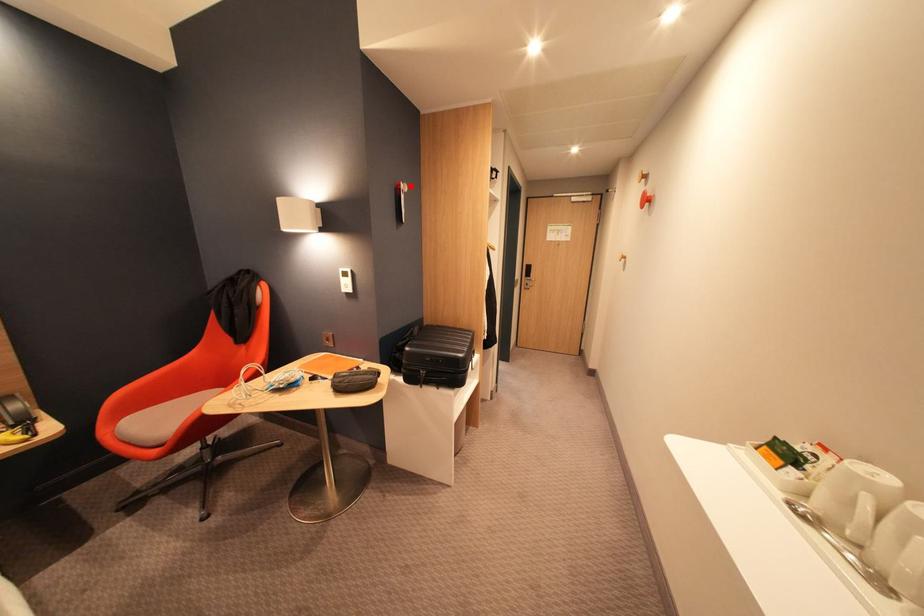
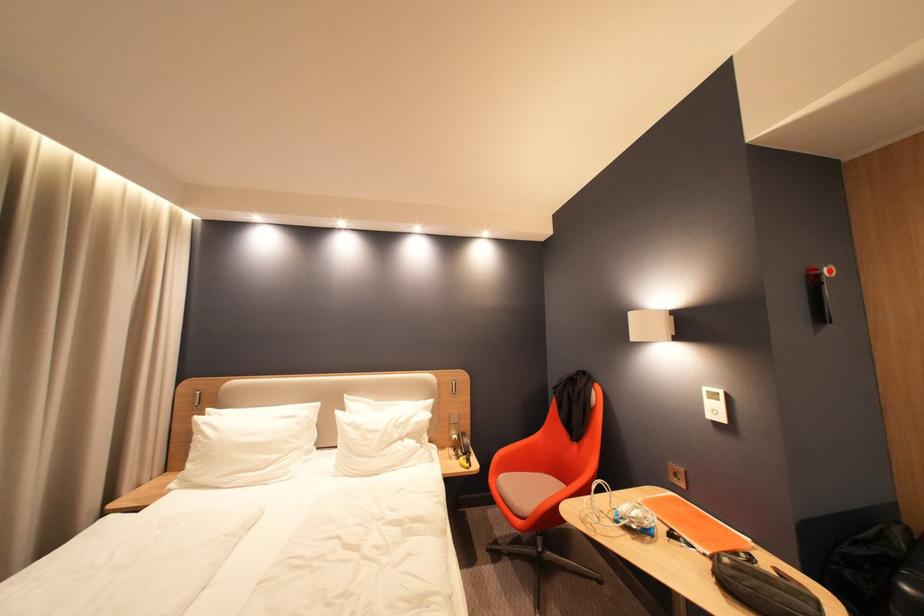
From the picture: I am providing you with two images of the same scene from different viewpoints. A red point is marked on the first image and another point is marked on the second image. Are the points marked in image1 and image2 representing the same 3D position?

Yes